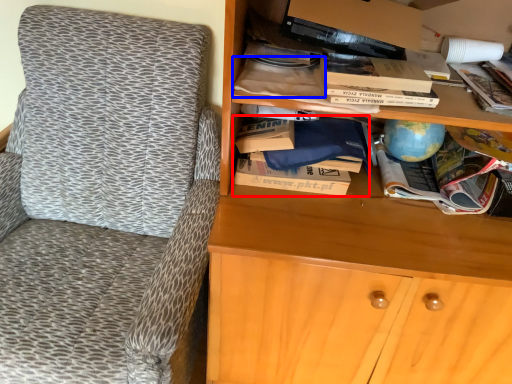
Question: Which object appears farthest to the camera in this image, book (highlighted by a red box) or book (highlighted by a blue box)?

Choices:
 (A) book
 (B) book

Answer: (A)